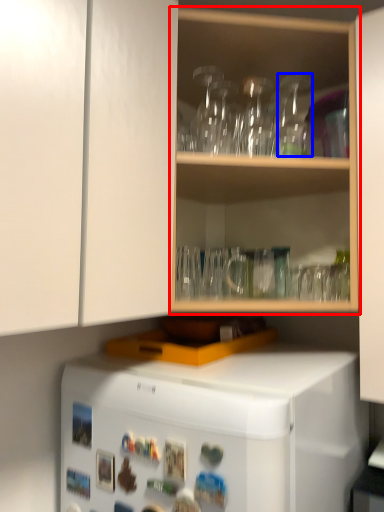
Question: Among these objects, which one is farthest to the camera, shelf (highlighted by a red box) or glass vase (highlighted by a blue box)?

Choices:
 (A) shelf
 (B) glass vase

Answer: (B)